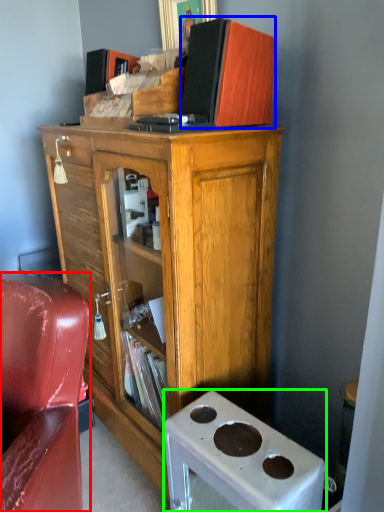
Question: Which object is positioned farthest from chair (highlighted by a red box)? Select from book (highlighted by a blue box) and desk (highlighted by a green box).

Choices:
 (A) book
 (B) desk

Answer: (A)